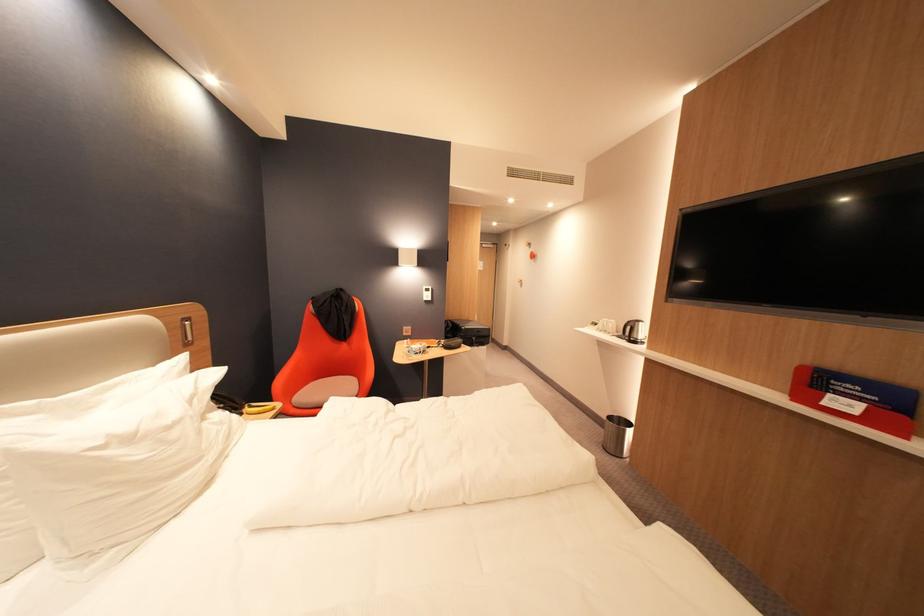
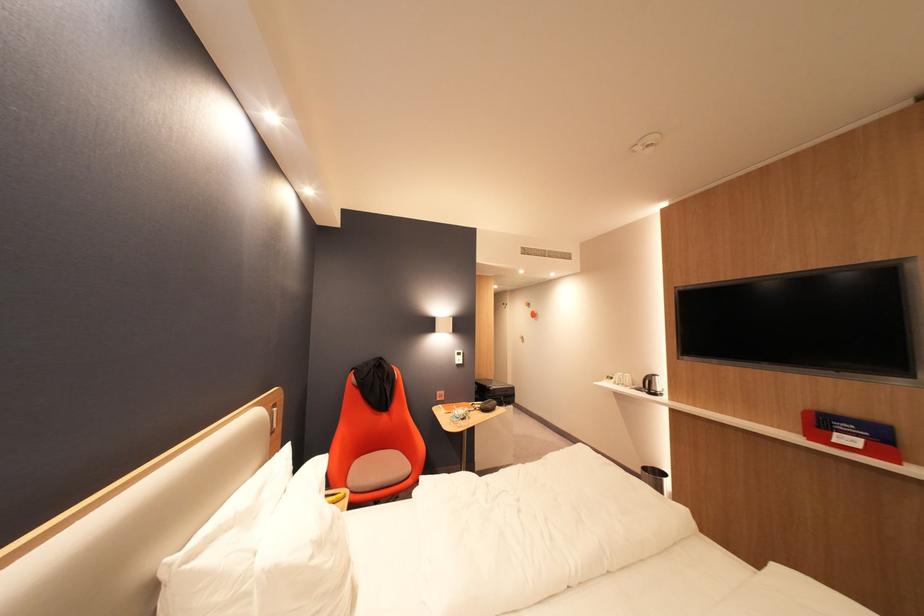
Where in the second image is the point corresponding to [537,253] from the first image?

(538, 313)